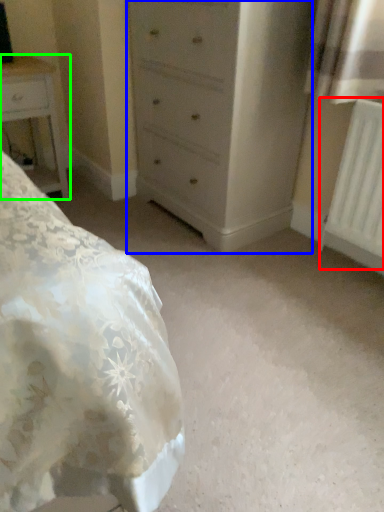
Question: Estimate the real-world distances between objects in this image. Which object is closer to radiator (highlighted by a red box), chest of drawers (highlighted by a blue box) or nightstand (highlighted by a green box)?

Choices:
 (A) chest of drawers
 (B) nightstand

Answer: (A)